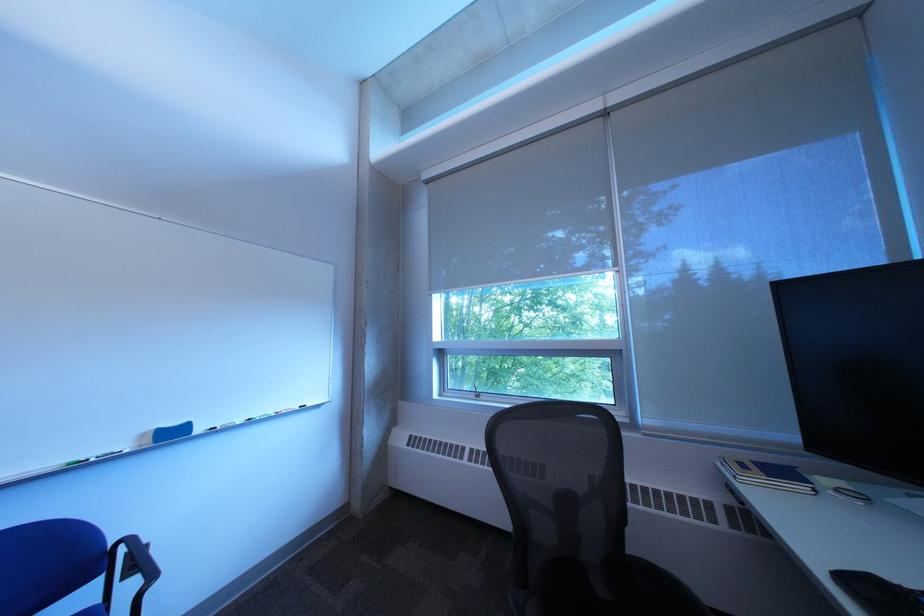
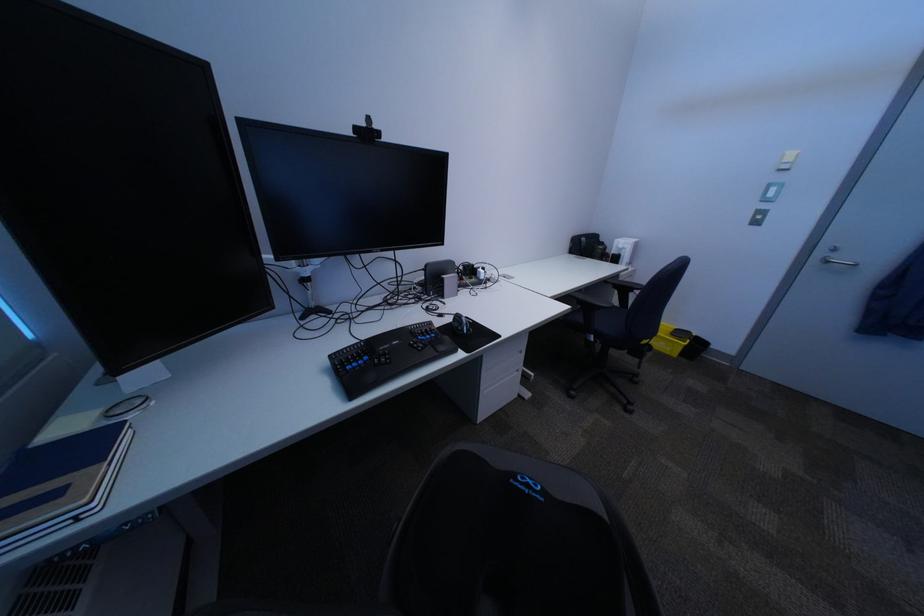
Locate, in the second image, the point that corresponds to (755,475) in the first image.

(101, 503)